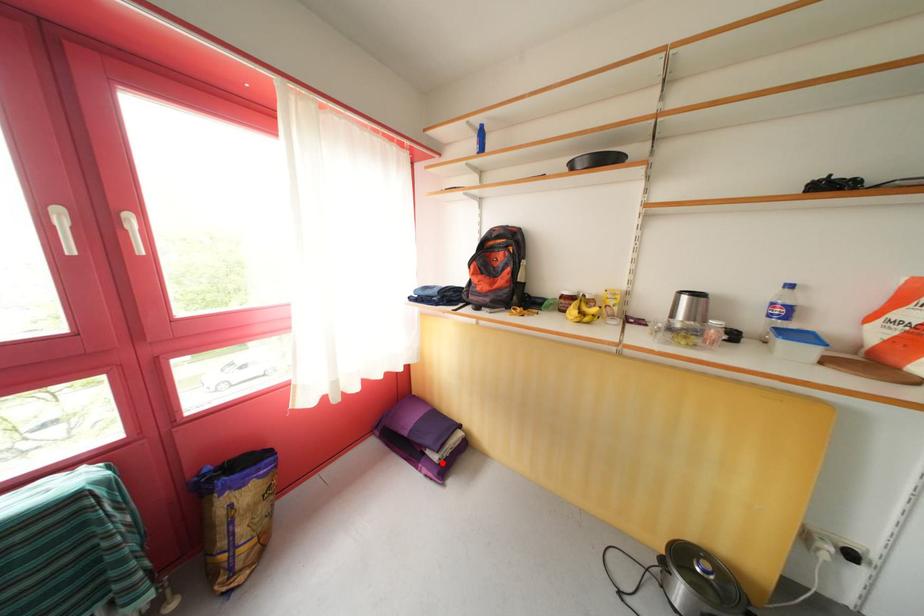
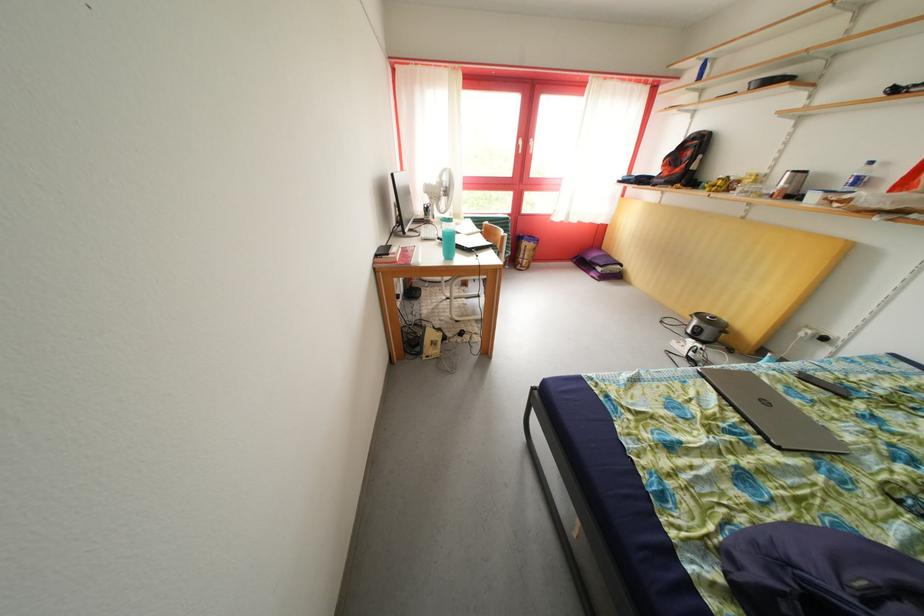
The point at the highlighted location is marked in the first image. Where is the corresponding point in the second image?

(608, 275)